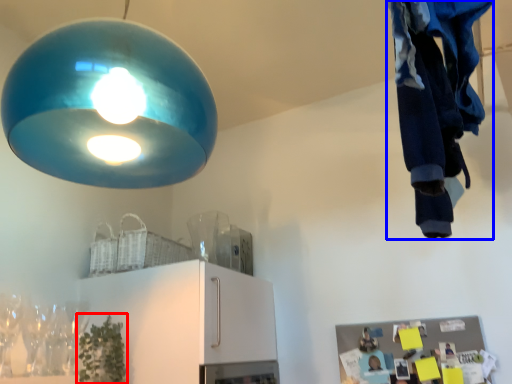
Question: Which point is closer to the camera, plant (highlighted by a red box) or clothing (highlighted by a blue box)?

Choices:
 (A) plant
 (B) clothing

Answer: (B)